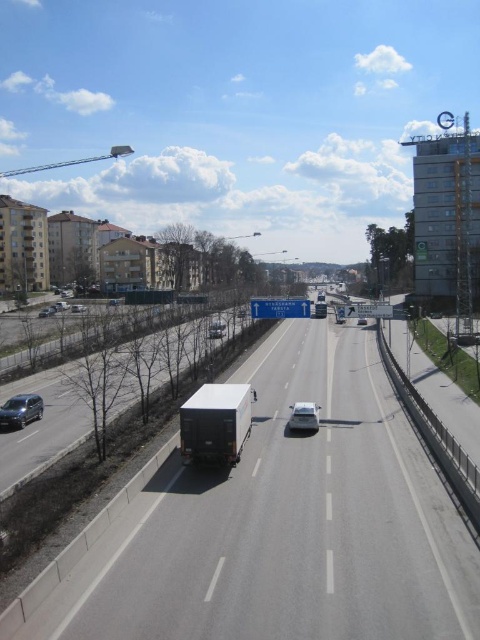
Is point (201, 387) in front of point (295, 417)?

No, (201, 387) is further to viewer.

Is white matte trailer truck at center above shiny silver sedan at center?

Indeed, white matte trailer truck at center is positioned over shiny silver sedan at center.

Is point (232, 458) less distant than point (315, 413)?

Yes.

Image resolution: width=480 pixels, height=640 pixels. What are the coordinates of `white matte trailer truck at center` in the screenshot? It's located at (216, 422).

Between white matte trailer truck at center and white glossy sedan at center, which one appears on the left side from the viewer's perspective?

white matte trailer truck at center

Based on the photo, does white matte trailer truck at center have a greater height compared to white glossy sedan at center?

Correct, white matte trailer truck at center is much taller as white glossy sedan at center.

The image size is (480, 640). Find the location of `white matte trailer truck at center`. white matte trailer truck at center is located at coordinates (216, 422).

Can you confirm if shiny black sedan at lower left is positioned below white glossy sedan at center?

Yes, shiny black sedan at lower left is below white glossy sedan at center.

Who is lower down, shiny black sedan at lower left or white glossy sedan at center?

shiny black sedan at lower left is lower down.

Is point (23, 420) in front of point (358, 323)?

Yes, point (23, 420) is in front of point (358, 323).

Find the location of a particular element. shiny black sedan at lower left is located at coordinates (21, 410).